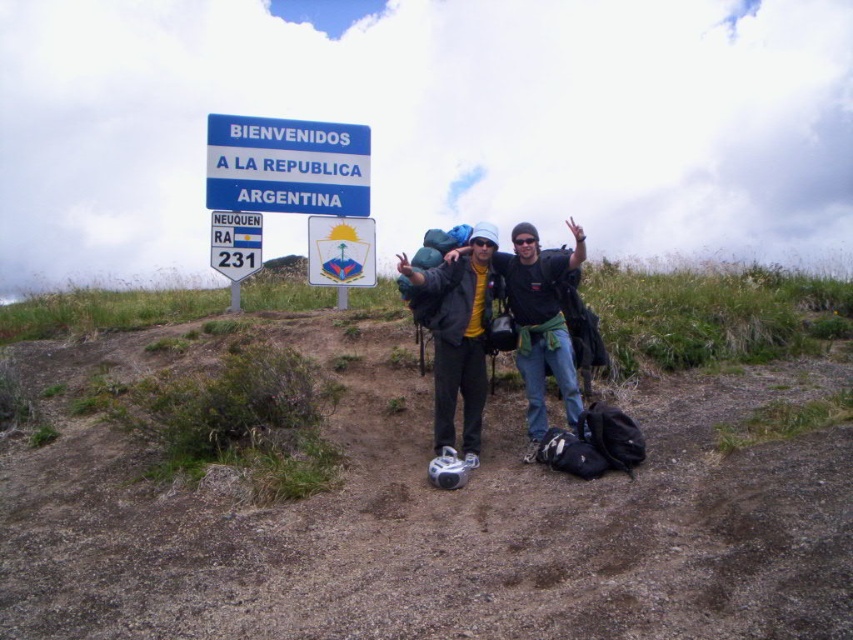
Consider the image. You are standing at point (316,243) and want to walk towards the signboard. Which direction should you move relative to point (563,332)?

You should move towards point (563,332) because it is in front of point (316,243), meaning the signboard is in that direction.

You are a photographer trying to capture the signboard and the hiker in the scene. Since the matte plastic sign at upper center and the matte black jacket at center are both in your frame, which object is positioned lower?

The matte black jacket at center is positioned lower than the matte plastic sign at upper center.

You are navigating a path and see two points marked on your map. The first point is at coordinates point (346, 125) and the second is at point (210, 236). According to the scene, which point is located behind the other?

Point (346, 125) is behind point (210, 236).